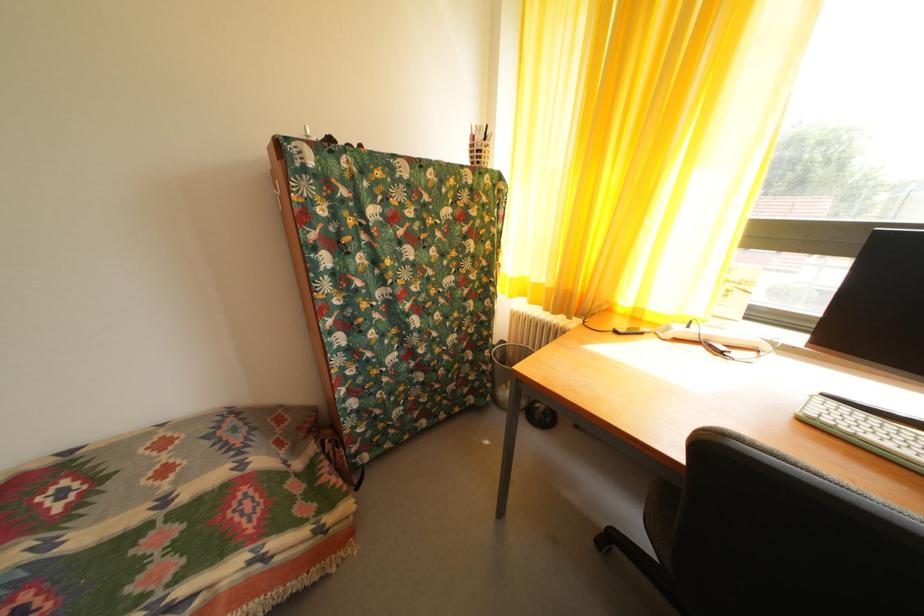
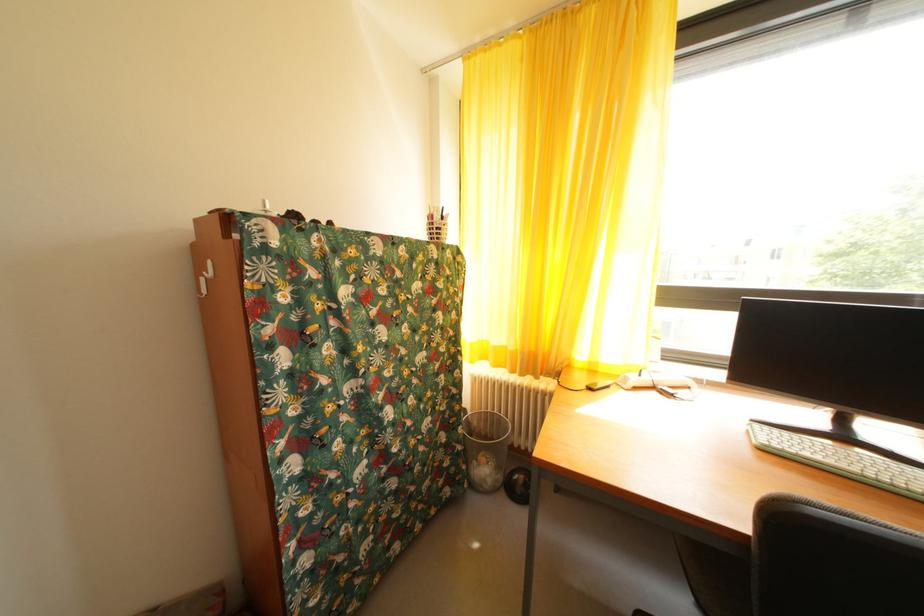
Where in the second image is the point corresponding to (543,291) from the first image?

(505, 354)